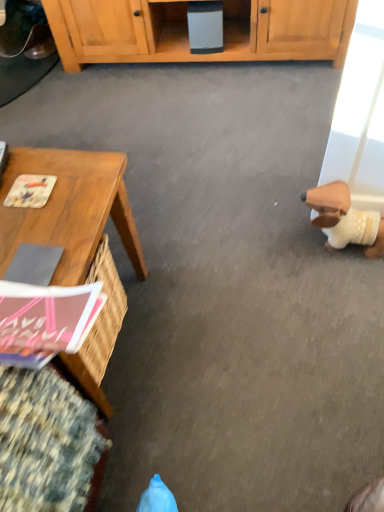
Locate an element on the screen. unoccupied region to the right of printed paper magazine at left, the 1th magazine when ordered from back to front is located at coordinates (82, 184).